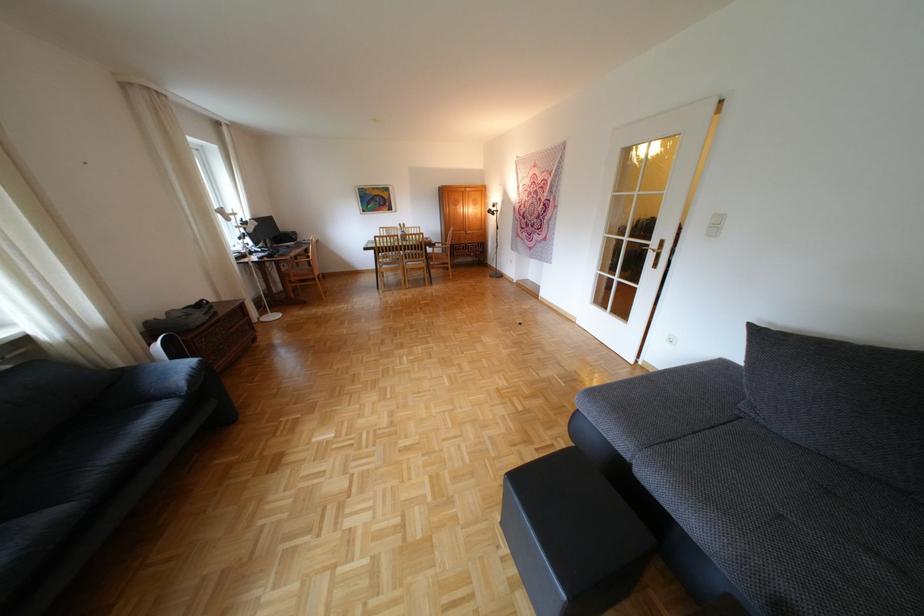
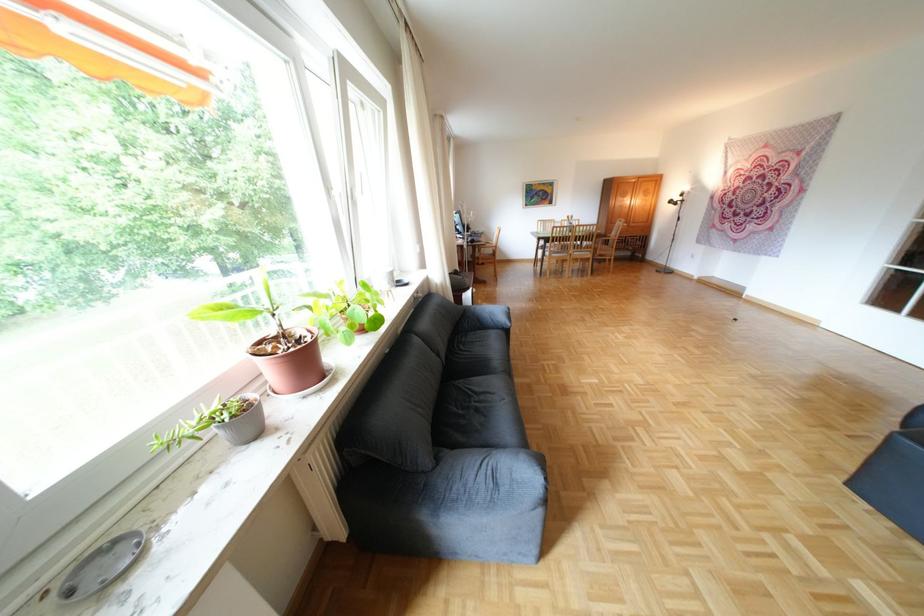
What movement of the cameraman would produce the second image?

The cameraman moved toward left, backward.